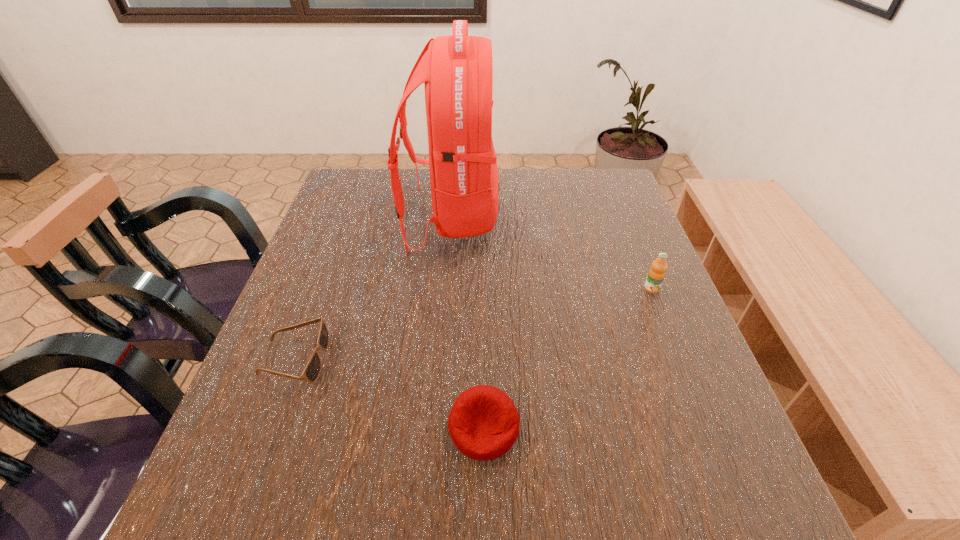
Where is `the second closest object relative to the tallest object`? This screenshot has width=960, height=540. the second closest object relative to the tallest object is located at coordinates (656, 274).

Find the location of a particular element. This screenshot has height=540, width=960. the closest object to the tallest object is located at coordinates (312, 370).

You are a GUI agent. You are given a task and a screenshot of the screen. Output one action in this format:
    pyautogui.click(x=<x>, y=<y>)
    Task: Click on the blank area in the image that satisfies the following two spatial constraints: 1. on the label of the rightmost object; 2. on the frames of the shortest object
    
    Given the screenshot: What is the action you would take?
    pyautogui.click(x=680, y=360)

This screenshot has height=540, width=960. Find the location of `free space that satisfies the following two spatial constraints: 1. on the label of the rightmost object; 2. on the frames of the leftmost object`. free space that satisfies the following two spatial constraints: 1. on the label of the rightmost object; 2. on the frames of the leftmost object is located at coordinates coord(680,360).